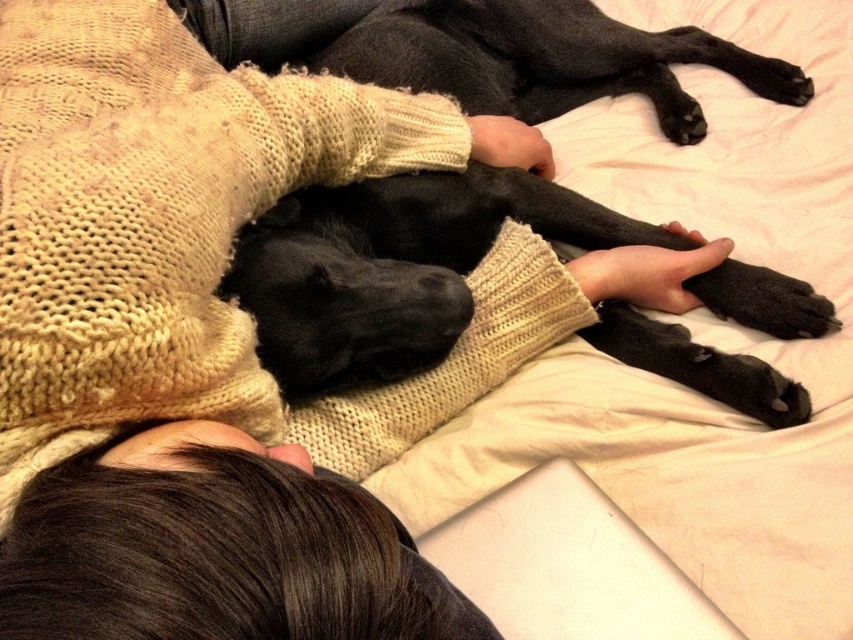
Question: Which of the following is the closest to the observer?

Choices:
 (A) (421, 614)
 (B) (476, 83)

Answer: (A)

Question: Is black smooth dog at center positioned at the back of brown knitted sweater at upper center?

Choices:
 (A) no
 (B) yes

Answer: (B)

Question: Is black smooth dog at center to the right of brown knitted sweater at upper center from the viewer's perspective?

Choices:
 (A) no
 (B) yes

Answer: (B)

Question: Which of the following is the farthest from the observer?

Choices:
 (A) brown knitted sweater at upper center
 (B) black smooth dog at center

Answer: (B)

Question: Can you confirm if black smooth dog at center is positioned to the right of brown knitted sweater at upper center?

Choices:
 (A) yes
 (B) no

Answer: (A)

Question: Among these points, which one is farthest from the camera?

Choices:
 (A) (114, 522)
 (B) (314, 330)

Answer: (B)